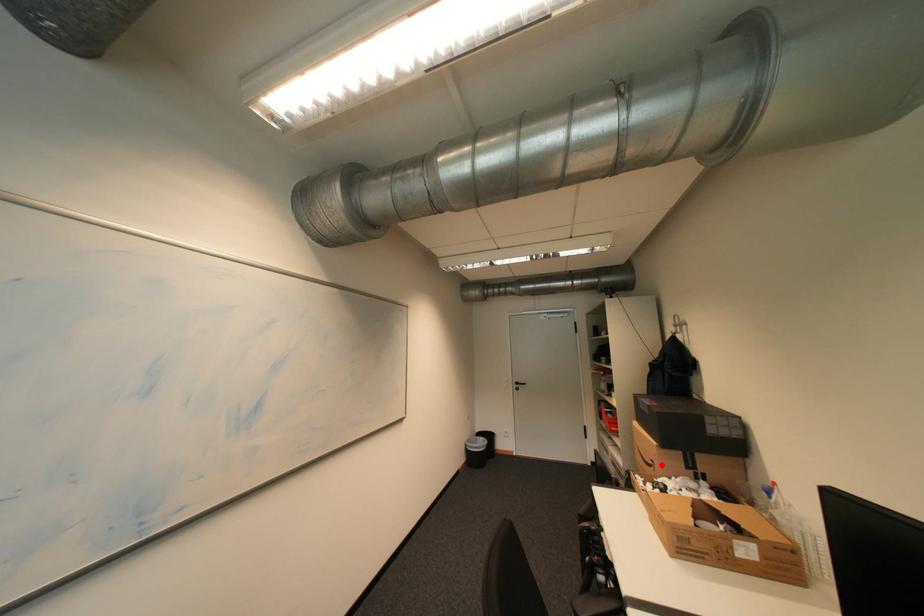
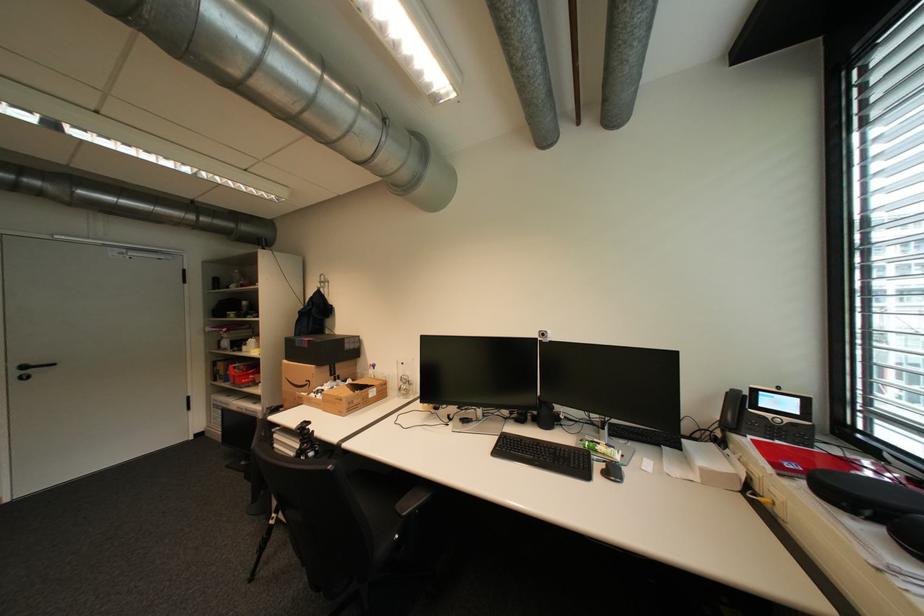
The point at the highlighted location is marked in the first image. Where is the corresponding point in the second image?

(317, 383)